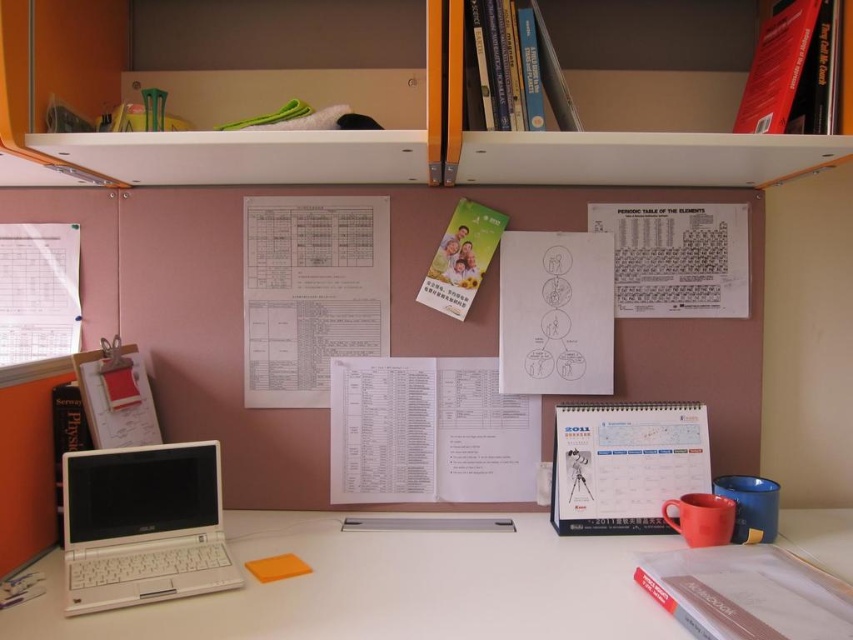
Can you confirm if white plastic computer desk at lower center is positioned to the right of white plastic shelf at upper center?

No, white plastic computer desk at lower center is not to the right of white plastic shelf at upper center.

Does white plastic computer desk at lower center have a lesser height compared to white plastic shelf at upper center?

Yes.

Locate an element on the screen. white plastic computer desk at lower center is located at coordinates (389, 588).

You are a GUI agent. You are given a task and a screenshot of the screen. Output one action in this format:
    pyautogui.click(x=<x>, y=<y>)
    Task: Click on the white plastic computer desk at lower center
    This screenshot has height=640, width=853.
    Given the screenshot: What is the action you would take?
    pyautogui.click(x=389, y=588)

Who is positioned more to the left, white plastic laptop at lower left or white plastic shelf at upper center?

white plastic laptop at lower left

Can you confirm if white plastic laptop at lower left is positioned above white plastic shelf at upper center?

Actually, white plastic laptop at lower left is below white plastic shelf at upper center.

Which is in front, point (183, 464) or point (612, 180)?

Point (183, 464)

Find the location of a particular element. The height and width of the screenshot is (640, 853). white plastic laptop at lower left is located at coordinates (143, 525).

Can you confirm if white plastic bookshelf at upper center is taller than white plastic computer desk at lower center?

Yes, white plastic bookshelf at upper center is taller than white plastic computer desk at lower center.

Is white plastic bookshelf at upper center to the left of white plastic computer desk at lower center from the viewer's perspective?

Yes, white plastic bookshelf at upper center is to the left of white plastic computer desk at lower center.

The image size is (853, 640). What do you see at coordinates (329, 131) in the screenshot? I see `white plastic bookshelf at upper center` at bounding box center [329, 131].

Locate an element on the screen. white plastic bookshelf at upper center is located at coordinates (329, 131).